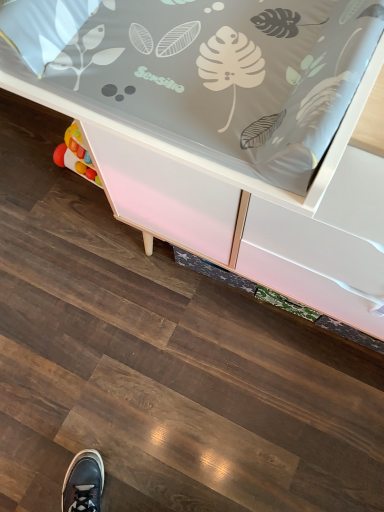
Identify the location of free space to the left of matte pink cabinet at center. tap(86, 290).